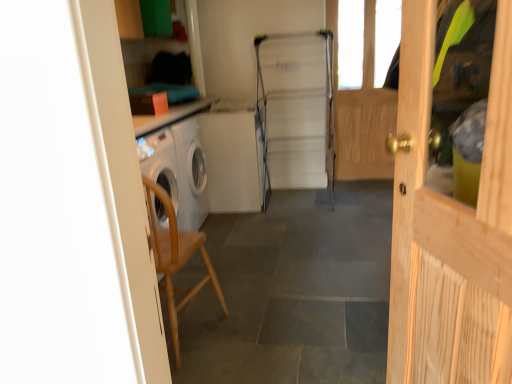
Question: Is light wood door at right facing away from wooden chair at left?

Choices:
 (A) yes
 (B) no

Answer: (B)

Question: Is the surface of light wood door at right in direct contact with wooden chair at left?

Choices:
 (A) no
 (B) yes

Answer: (A)

Question: From a real-world perspective, is light wood door at right positioned under wooden chair at left based on gravity?

Choices:
 (A) no
 (B) yes

Answer: (A)

Question: Would you say light wood door at right is outside wooden chair at left?

Choices:
 (A) no
 (B) yes

Answer: (B)

Question: From a real-world perspective, is light wood door at right physically above wooden chair at left?

Choices:
 (A) no
 (B) yes

Answer: (B)

Question: From a real-world perspective, is wooden chair at left above or below wooden screen door at right?

Choices:
 (A) above
 (B) below

Answer: (B)

Question: Is wooden chair at left wider or thinner than wooden screen door at right?

Choices:
 (A) thin
 (B) wide

Answer: (B)

Question: Considering the positions of point (159, 243) and point (373, 8), is point (159, 243) closer or farther from the camera than point (373, 8)?

Choices:
 (A) closer
 (B) farther

Answer: (A)

Question: From the image's perspective, is wooden chair at left above or below wooden screen door at right?

Choices:
 (A) below
 (B) above

Answer: (A)

Question: From the image's perspective, relative to wooden chair at left, is light wood door at right above or below?

Choices:
 (A) above
 (B) below

Answer: (A)

Question: In the image, is light wood door at right positioned in front of or behind wooden chair at left?

Choices:
 (A) front
 (B) behind

Answer: (A)

Question: Is point (483, 331) positioned closer to the camera than point (345, 357)?

Choices:
 (A) farther
 (B) closer

Answer: (B)

Question: Is light wood door at right spatially inside wooden chair at left, or outside of it?

Choices:
 (A) inside
 (B) outside

Answer: (B)

Question: Is metallic silver fridge at center taller or shorter than wooden chair at left?

Choices:
 (A) short
 (B) tall

Answer: (B)

Question: Would you say metallic silver fridge at center is inside or outside wooden chair at left?

Choices:
 (A) inside
 (B) outside

Answer: (B)